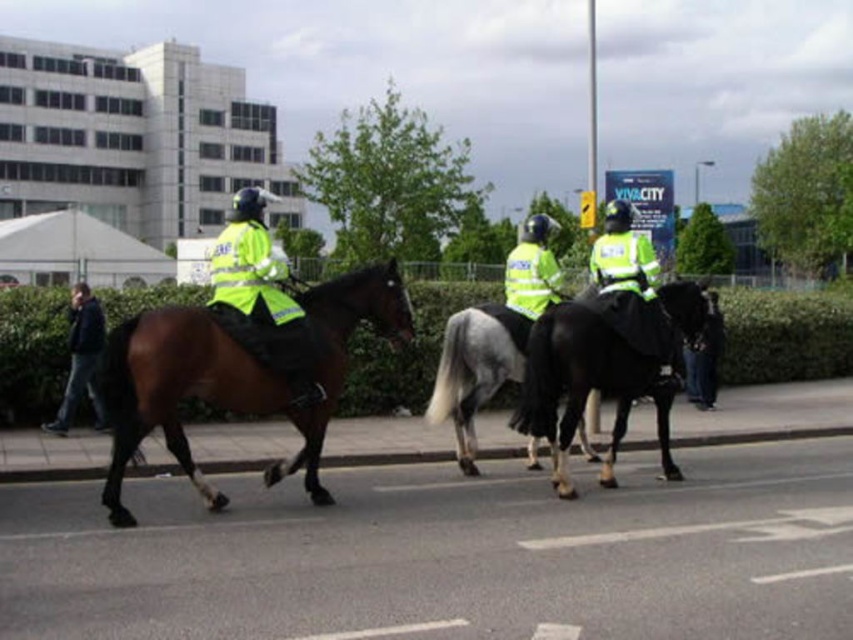
You are a pedestrian trying to cross the street where the mounted police are moving forward. There are two points marked on the road ahead of you. The first point is at coordinate point(x=161, y=340) and the second point is at coordinate point(x=444, y=362). Which point should you avoid to stay safe from the mounted police path?

You should avoid point(x=444, y=362) because point(x=161, y=340) is in front of it, meaning the mounted police are moving towards that direction and the second point is further along their path.